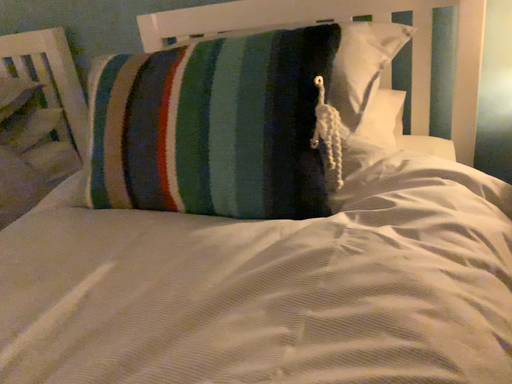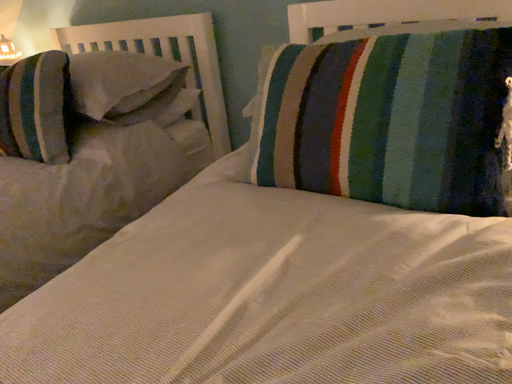
Question: How did the camera likely rotate when shooting the video?

Choices:
 (A) rotated right
 (B) rotated left

Answer: (B)